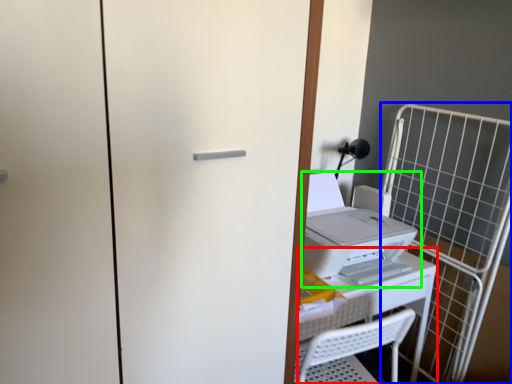
Question: Based on their relative distances, which object is nearer to table (highlighted by a red box)? Choose from cage (highlighted by a blue box) and home appliance (highlighted by a green box).

Choices:
 (A) cage
 (B) home appliance

Answer: (B)